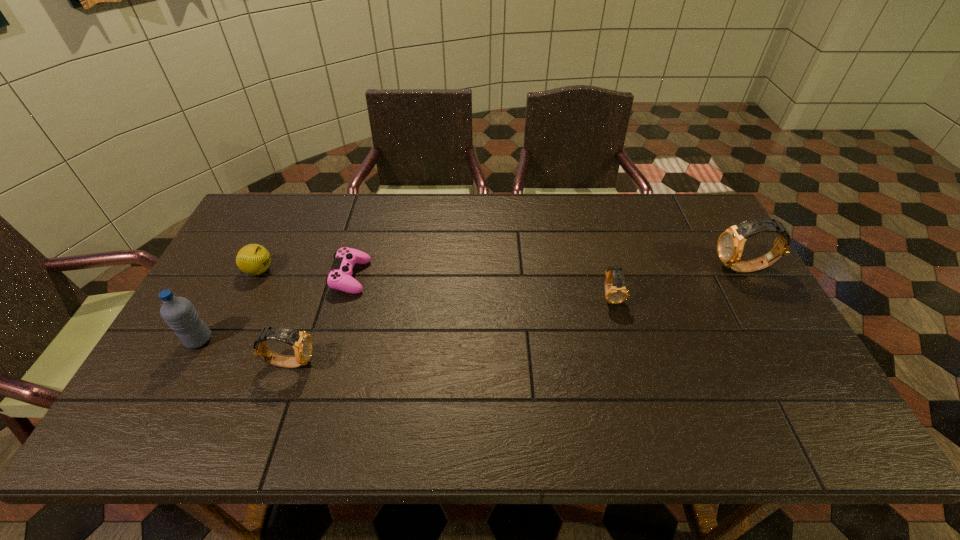
Find the location of a particular element. watch that is the third closest one to the softball is located at coordinates (730, 245).

Where is `vacant region that satisfies the following two spatial constraints: 1. on the logo side of the control; 2. on the right side of the softball`? vacant region that satisfies the following two spatial constraints: 1. on the logo side of the control; 2. on the right side of the softball is located at coordinates (256, 276).

Locate an element on the screen. The width and height of the screenshot is (960, 540). free space that satisfies the following two spatial constraints: 1. on the face of the tallest watch; 2. on the face of the second nearest watch is located at coordinates (759, 296).

The width and height of the screenshot is (960, 540). I want to click on blank space that satisfies the following two spatial constraints: 1. on the logo side of the softball; 2. on the back side of the control, so tap(256, 276).

The image size is (960, 540). Find the location of `vacant space that satisfies the following two spatial constraints: 1. on the logo side of the softball; 2. on the back side of the shortest object`. vacant space that satisfies the following two spatial constraints: 1. on the logo side of the softball; 2. on the back side of the shortest object is located at coordinates (256, 276).